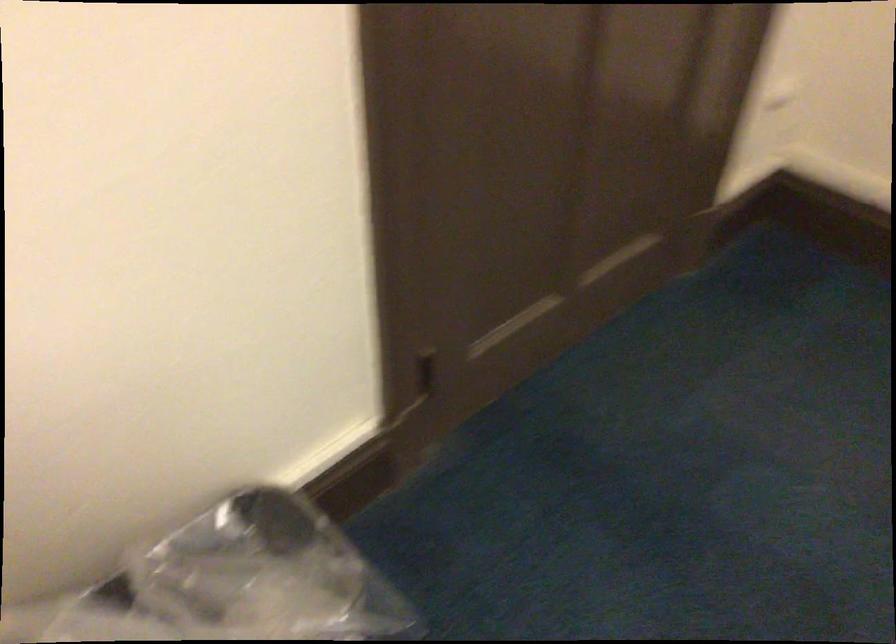
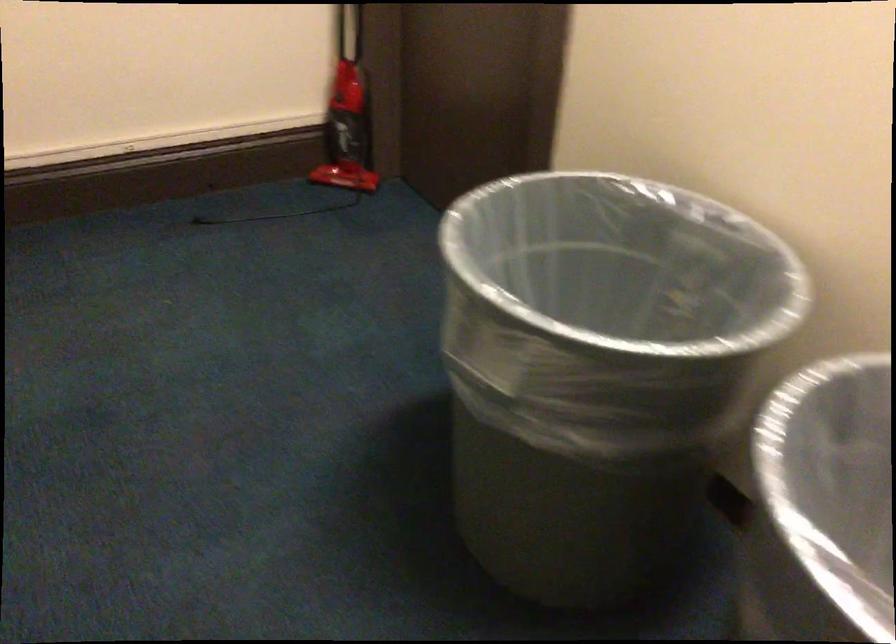
How did the camera likely rotate?

The camera's rotation is toward right-down.